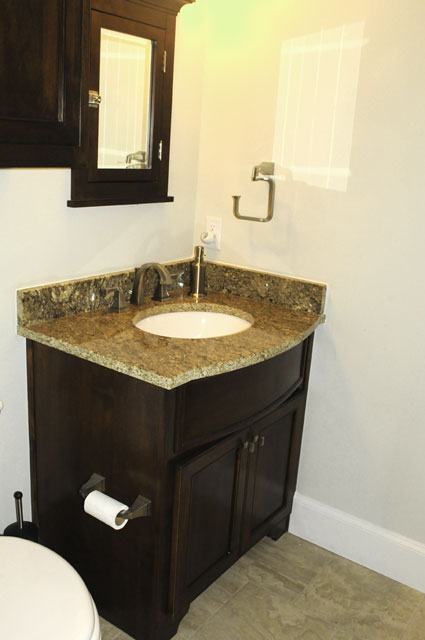
I want to click on toilet lid, so click(36, 589).